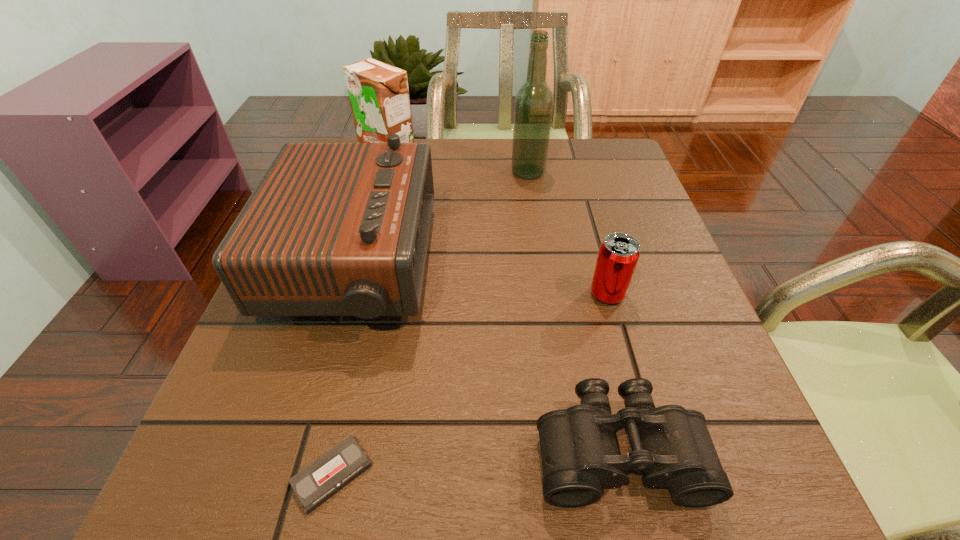
The height and width of the screenshot is (540, 960). In order to click on the tallest object in this screenshot , I will do `click(533, 109)`.

Identify the location of carton. (379, 97).

Where is `the fourth shortest object`? This screenshot has width=960, height=540. the fourth shortest object is located at coordinates (332, 229).

Locate an element on the screen. the third shortest object is located at coordinates (x=618, y=255).

Image resolution: width=960 pixels, height=540 pixels. In order to click on the second shortest object in this screenshot , I will do `click(671, 445)`.

At what (x,y) coordinates should I click in order to perform the action: click on the shortest object. Please return your answer as a coordinate pair (x, y). This screenshot has height=540, width=960. Looking at the image, I should click on (319, 481).

Image resolution: width=960 pixels, height=540 pixels. In order to click on blank area located on the right of the tallest object in this screenshot , I will do `click(605, 172)`.

Identify the location of free location located on the straw side of the carton. This screenshot has height=540, width=960. (360, 252).

Where is `blank space located on the tuning display of the third tallest object`? blank space located on the tuning display of the third tallest object is located at coordinates (621, 266).

The width and height of the screenshot is (960, 540). What are the coordinates of `vacant space located on the front of the third shortest object` in the screenshot? It's located at (663, 494).